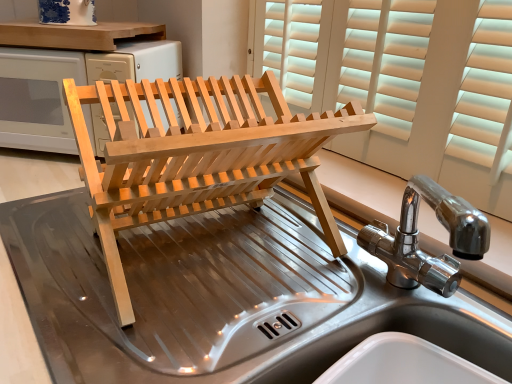
Question: Can we say natural wood dish rack at center lies outside stainless steel sink at center, which ranks as the first sink in bottom-to-top order?

Choices:
 (A) no
 (B) yes

Answer: (A)

Question: Is natural wood dish rack at center oriented away from stainless steel sink at center, which ranks as the first sink in bottom-to-top order?

Choices:
 (A) no
 (B) yes

Answer: (A)

Question: Is natural wood dish rack at center to the left of stainless steel sink at center, which ranks as the first sink in bottom-to-top order, from the viewer's perspective?

Choices:
 (A) no
 (B) yes

Answer: (A)

Question: Considering the relative positions of natural wood dish rack at center and stainless steel sink at center, the second sink from the top, in the image provided, is natural wood dish rack at center to the right of stainless steel sink at center, the second sink from the top, from the viewer's perspective?

Choices:
 (A) no
 (B) yes

Answer: (B)

Question: From the image's perspective, is natural wood dish rack at center over stainless steel sink at center, which ranks as the first sink in bottom-to-top order?

Choices:
 (A) no
 (B) yes

Answer: (B)

Question: Is natural wood dish rack at center directly adjacent to stainless steel sink at center, which ranks as the first sink in bottom-to-top order?

Choices:
 (A) no
 (B) yes

Answer: (A)

Question: Would you say natural wood dish rack at center is part of polished stainless steel sink at center, the second sink from the bottom,'s contents?

Choices:
 (A) no
 (B) yes

Answer: (A)

Question: Can you confirm if polished stainless steel sink at center, the second sink from the bottom, is thinner than natural wood dish rack at center?

Choices:
 (A) no
 (B) yes

Answer: (B)

Question: Is polished stainless steel sink at center, placed as the 1th sink when sorted from top to bottom, taller than natural wood dish rack at center?

Choices:
 (A) yes
 (B) no

Answer: (B)

Question: Is the depth of polished stainless steel sink at center, placed as the 1th sink when sorted from top to bottom, less than that of natural wood dish rack at center?

Choices:
 (A) yes
 (B) no

Answer: (A)

Question: Is natural wood dish rack at center at the back of polished stainless steel sink at center, the second sink from the bottom?

Choices:
 (A) yes
 (B) no

Answer: (B)

Question: Is polished stainless steel sink at center, placed as the 1th sink when sorted from top to bottom, at the right side of natural wood dish rack at center?

Choices:
 (A) yes
 (B) no

Answer: (A)

Question: From a real-world perspective, is stainless steel sink at center, which ranks as the first sink in bottom-to-top order, beneath natural wood dish rack at center?

Choices:
 (A) yes
 (B) no

Answer: (A)